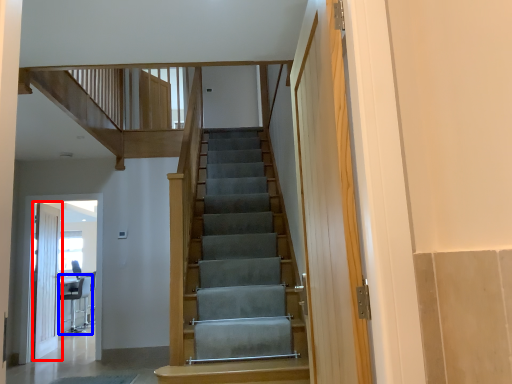
Question: Which object appears closest to the camera in this image, door (highlighted by a red box) or chair (highlighted by a blue box)?

Choices:
 (A) door
 (B) chair

Answer: (A)